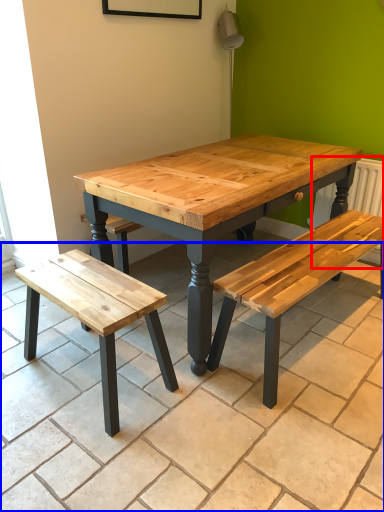
Question: Which of the following is the farthest to the observer, radiator (highlighted by a red box) or tile (highlighted by a blue box)?

Choices:
 (A) radiator
 (B) tile

Answer: (A)